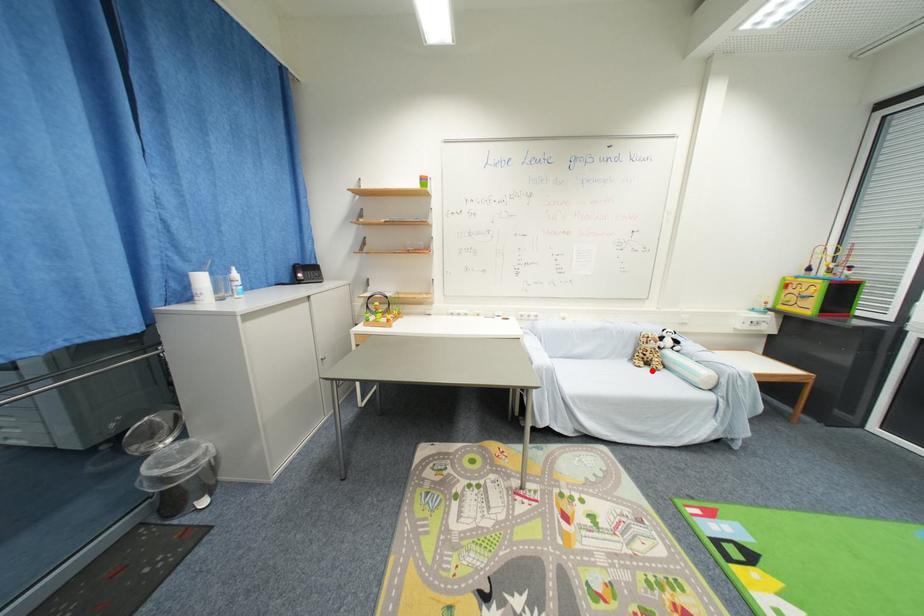
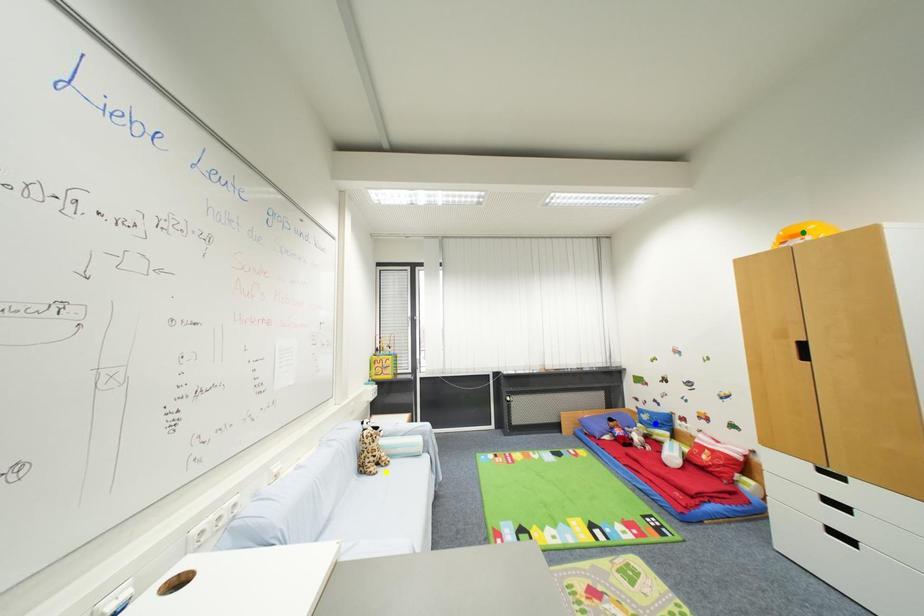
Question: I am providing you with two images of the same scene from different viewpoints. A red point is marked on the first image. You are given multiple points on the second image. Can you choose the point in image 2 that corresponds to the point in image 1?

Choices:
 (A) blue point
 (B) green point
 (C) yellow point

Answer: (C)